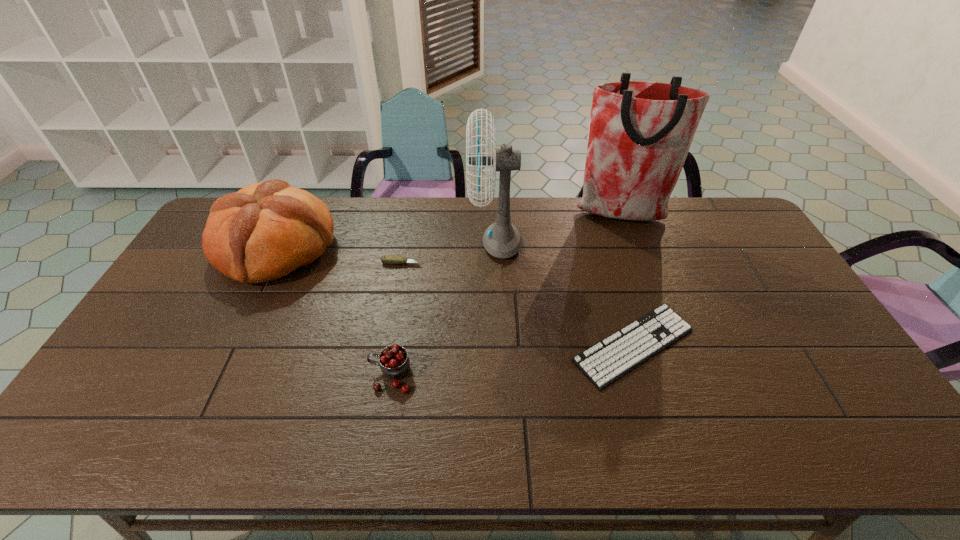
At what (x,y) coordinates should I click in order to perform the action: click on object positioned at the left edge. Please return your answer as a coordinate pair (x, y). Image resolution: width=960 pixels, height=540 pixels. Looking at the image, I should click on (266, 230).

You are a GUI agent. You are given a task and a screenshot of the screen. Output one action in this format:
    pyautogui.click(x=<x>, y=<y>)
    Task: Click on the object at the far left corner
    The image size is (960, 540).
    Given the screenshot: What is the action you would take?
    [266, 230]

I want to click on free region at the far edge of the desktop, so click(x=462, y=215).

This screenshot has height=540, width=960. What are the coordinates of `vacant space at the near edge` in the screenshot? It's located at (647, 421).

Identify the location of free space at the left edge of the desktop. The height and width of the screenshot is (540, 960). (199, 303).

Identify the location of vacant area that lies between the cherry and the leftmost object. (334, 312).

Identify the location of free space between the bread and the shortest object. The image size is (960, 540). (455, 296).

Locate an element on the screen. The height and width of the screenshot is (540, 960). unoccupied position between the second shortest object and the fourth object from left to right is located at coordinates pyautogui.click(x=448, y=253).

This screenshot has width=960, height=540. I want to click on free space between the leftmost object and the pocketknife, so click(339, 255).

The image size is (960, 540). What are the coordinates of `vacant region between the fourth tallest object and the computer keyboard` in the screenshot? It's located at (513, 360).